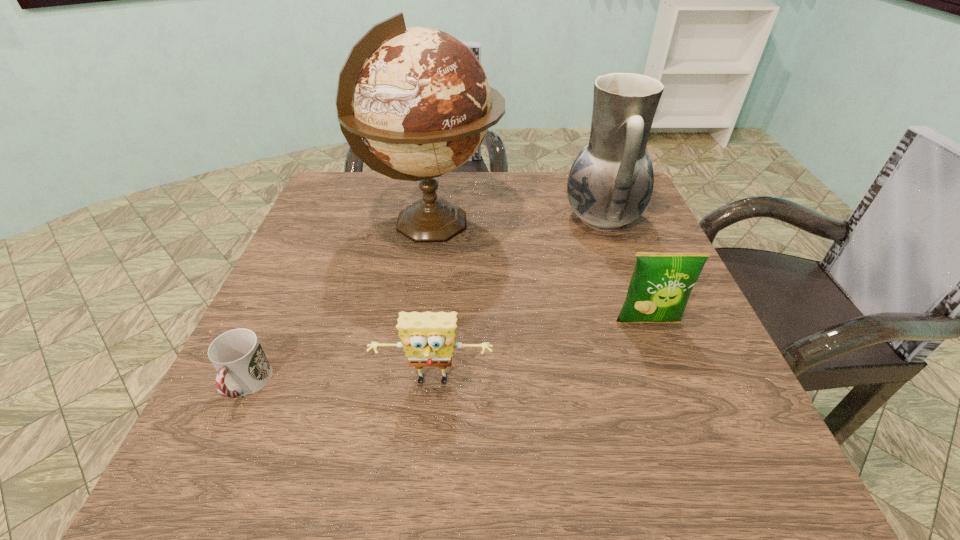
Where is `vacant space that satisfies the following two spatial constraints: 1. on the front-facing side of the pitcher; 2. on the handle side of the cup`? The height and width of the screenshot is (540, 960). vacant space that satisfies the following two spatial constraints: 1. on the front-facing side of the pitcher; 2. on the handle side of the cup is located at coordinates (662, 385).

Where is `vacant area in the image that satisfies the following two spatial constraints: 1. on the front-facing side of the pitcher; 2. on the handle side of the leftmost object`? The height and width of the screenshot is (540, 960). vacant area in the image that satisfies the following two spatial constraints: 1. on the front-facing side of the pitcher; 2. on the handle side of the leftmost object is located at coordinates (662, 385).

At what (x,y) coordinates should I click in order to perform the action: click on free spot that satisfies the following two spatial constraints: 1. on the front-facing side of the pitcher; 2. on the face of the second shortest object. Please return your answer as a coordinate pair (x, y). This screenshot has height=540, width=960. Looking at the image, I should click on (661, 383).